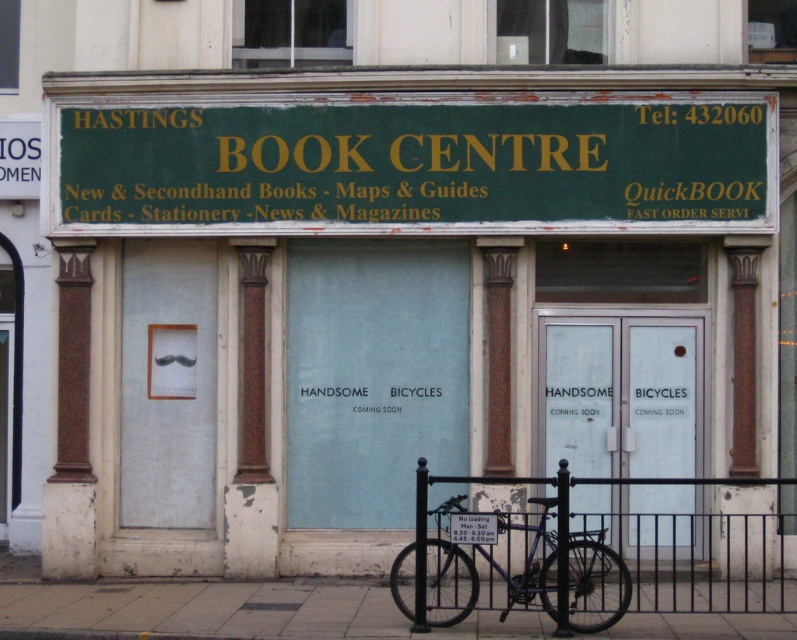
Question: Which point is farther to the camera?

Choices:
 (A) (446, 513)
 (B) (97, 612)
 (C) (576, 163)

Answer: (C)

Question: Is concrete sidewalk at lower center further to the viewer compared to shiny blue bicycle at center?

Choices:
 (A) no
 (B) yes

Answer: (B)

Question: In this image, where is green painted wood signboard at upper center located relative to shiny blue bicycle at center?

Choices:
 (A) right
 (B) left

Answer: (B)

Question: Among these objects, which one is farthest from the camera?

Choices:
 (A) shiny blue bicycle at center
 (B) green painted wood signboard at upper center
 (C) concrete sidewalk at lower center

Answer: (B)

Question: Among these points, which one is farthest from the camera?

Choices:
 (A) (493, 145)
 (B) (611, 593)

Answer: (A)

Question: Can you confirm if concrete sidewalk at lower center is positioned above shiny blue bicycle at center?

Choices:
 (A) no
 (B) yes

Answer: (A)